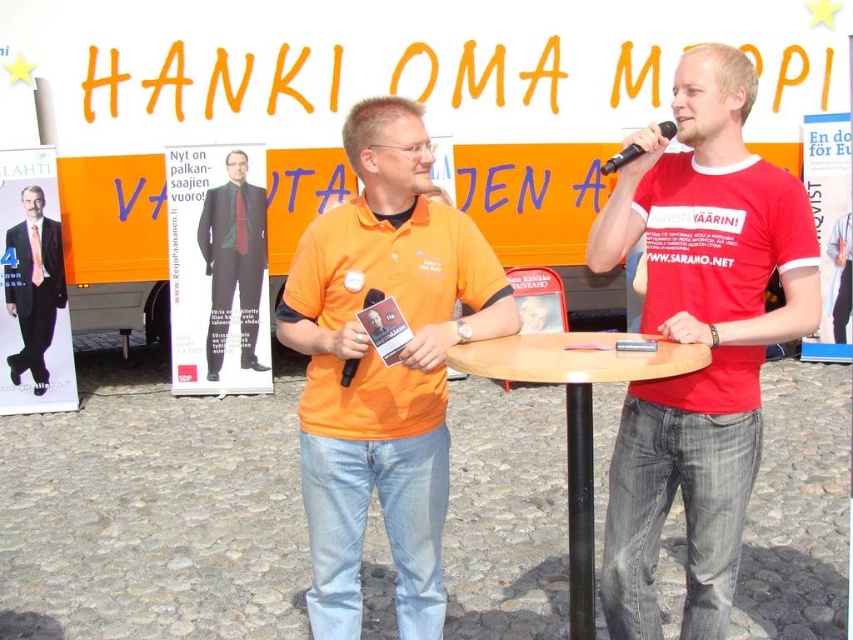
Question: Which of the following is the farthest from the observer?

Choices:
 (A) dark suit at center
 (B) orange cotton polo shirt at center
 (C) wooden table at center
 (D) red cotton t-shirt at center

Answer: (A)

Question: Is wooden table at center below dark suit at left?

Choices:
 (A) no
 (B) yes

Answer: (B)

Question: Which point is farther to the camera?

Choices:
 (A) (386, 397)
 (B) (689, 368)
 (C) (227, 316)
 (D) (637, 148)

Answer: (C)

Question: Does orange cotton polo shirt at center have a lesser width compared to wooden table at center?

Choices:
 (A) no
 (B) yes

Answer: (A)

Question: Which point appears farthest from the camera in this image?

Choices:
 (A) [236, 252]
 (B) [589, 625]
 (C) [373, 301]
 (D) [364, 216]

Answer: (A)

Question: Can you confirm if black plastic microphone at upper center is wider than black plastic microphone at center?

Choices:
 (A) no
 (B) yes

Answer: (B)